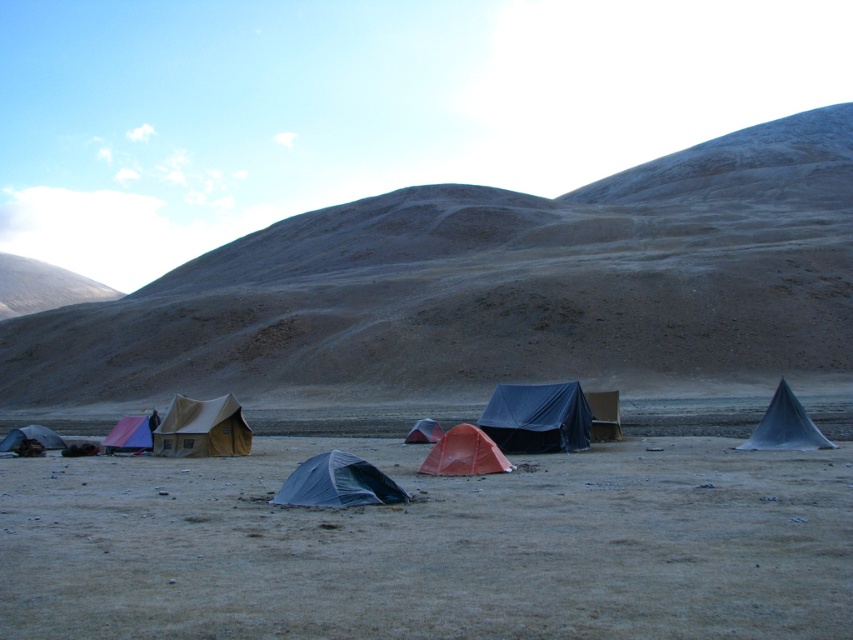
Who is more distant from viewer, (837, 340) or (55, 442)?

Point (837, 340)

Is dull gray rock at center shorter than matte beige tent at lower left?

No.

Between point (62, 342) and point (28, 432), which one is positioned behind?

The point (62, 342) is more distant.

You are a GUI agent. You are given a task and a screenshot of the screen. Output one action in this format:
    pyautogui.click(x=<x>, y=<y>)
    Task: Click on the dull gray rock at center
    This screenshot has width=853, height=640.
    Given the screenshot: What is the action you would take?
    pyautogui.click(x=492, y=284)

Is point (184, 424) farther from camera compared to point (430, 428)?

No, (184, 424) is in front of (430, 428).

Can you confirm if matte beige tent at center is positioned above matte gray tent at center?

Yes, matte beige tent at center is above matte gray tent at center.

Is point (167, 406) farther from camera compared to point (432, 422)?

That is True.

Where is `matte beige tent at center`? matte beige tent at center is located at coordinates (202, 428).

Which is in front, point (572, 404) or point (447, 433)?

Point (447, 433)

Who is shorter, black tarp tent at center or orange fabric tent at center?

With less height is orange fabric tent at center.

Where is `black tarp tent at center`? The width and height of the screenshot is (853, 640). black tarp tent at center is located at coordinates (537, 417).

The image size is (853, 640). In order to click on black tarp tent at center in this screenshot , I will do `click(537, 417)`.